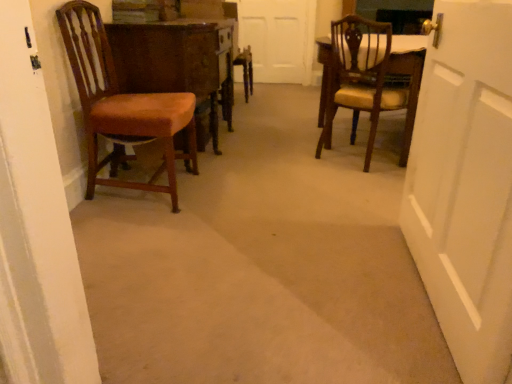
Find the location of a particular element. This screenshot has height=384, width=512. empty space that is to the right of wooden polished table at left is located at coordinates (276, 142).